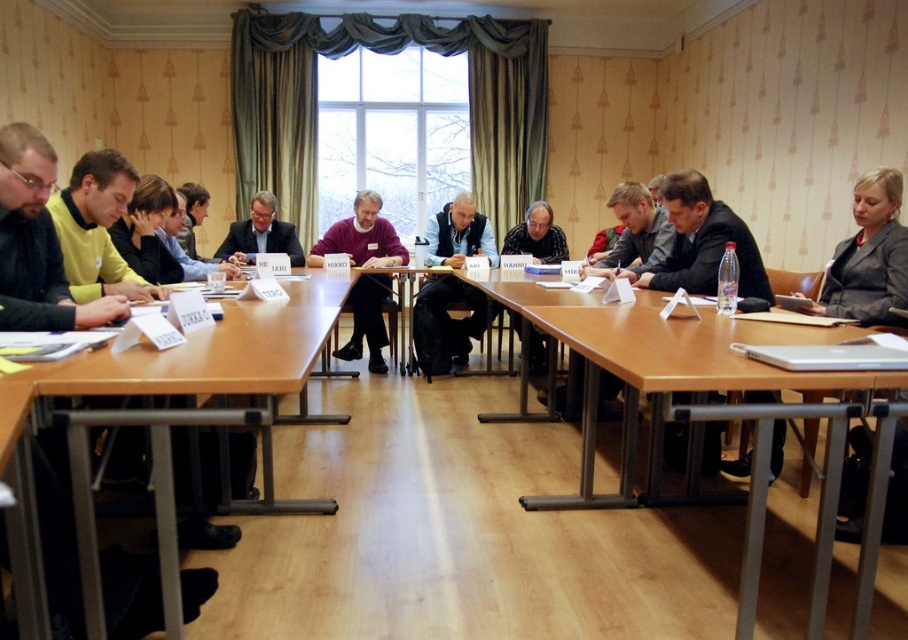
You are standing at the entrance of the room and see the point marked at coordinates (165, 428). Based on the scene description, which object is located at that point?

The point at coordinates (165, 428) corresponds to the brown wooden table at lower left.

Looking at this image, you are standing at the entrance of the room and see the point marked at coordinates (706,419). What object is located at that point?

The point at coordinates (706,419) indicates the brown wooden table at center.

You are attending a meeting and need to place a folder on the nearest object to you. Which object should you choose between the brown wooden table at center and the maroon sweater at center?

The brown wooden table at center is closer to the viewer than the maroon sweater at center, so you should place the folder on the brown wooden table at center.